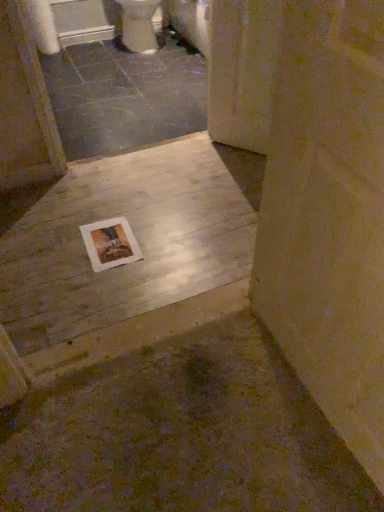
I want to click on free location to the right of white paper at center, so click(163, 260).